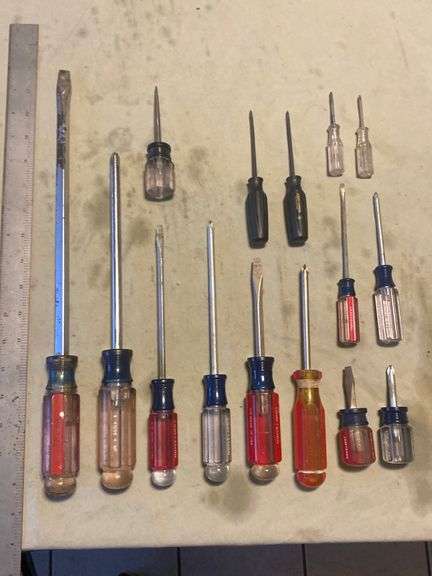
At what (x,y) coordinates should I click in order to perform the action: click on flat surface. Please return your answer as a coordinate pair (x, y). The width and height of the screenshot is (432, 576). Looking at the image, I should click on (290, 45).